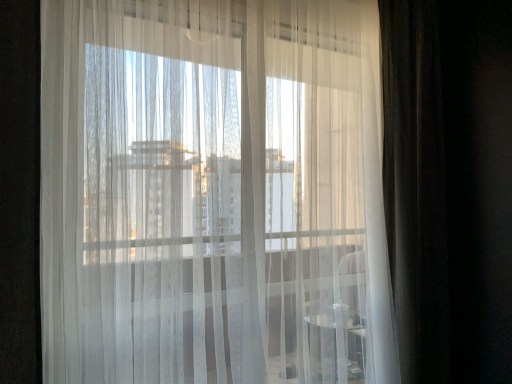
What is the approximate height of translucent white curtain at center?

translucent white curtain at center is 1.73 meters in height.

At what (x,y) coordinates should I click in order to perform the action: click on translucent white curtain at center. Please return your answer as a coordinate pair (x, y). Looking at the image, I should click on (213, 193).

Describe the element at coordinates (213, 193) in the screenshot. I see `translucent white curtain at center` at that location.

Identify the location of translucent white curtain at center. The image size is (512, 384). (213, 193).